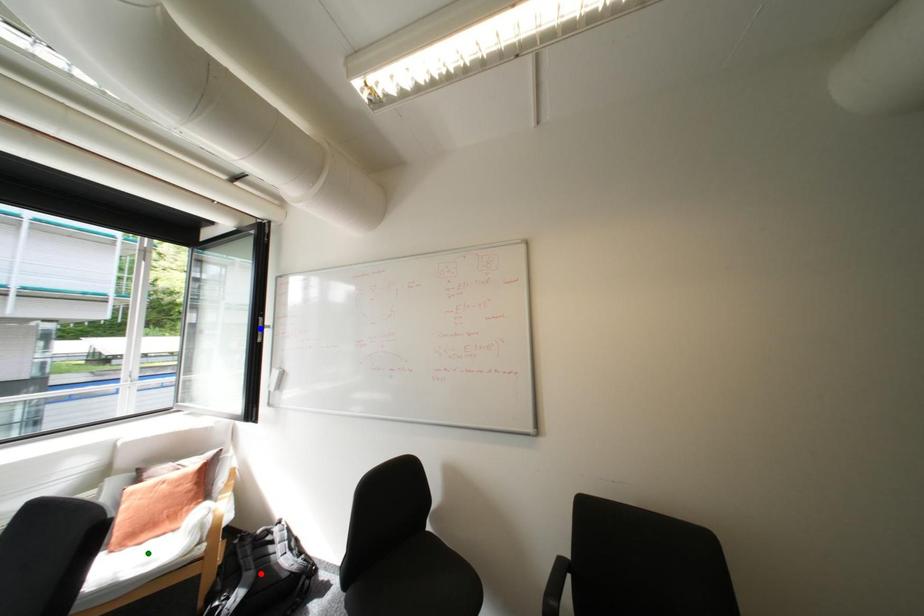
Order these from nearest to farthest:
red point
blue point
green point

blue point < red point < green point